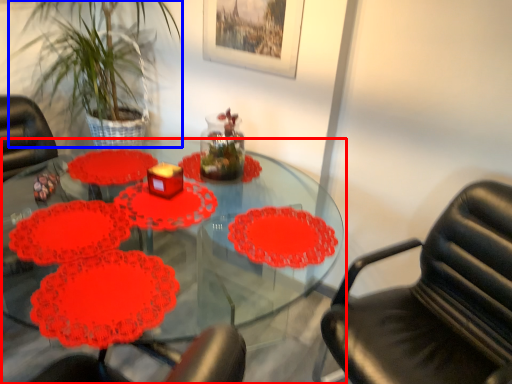
Question: Among these objects, which one is farthest to the camera, table (highlighted by a red box) or plant (highlighted by a blue box)?

Choices:
 (A) table
 (B) plant

Answer: (B)